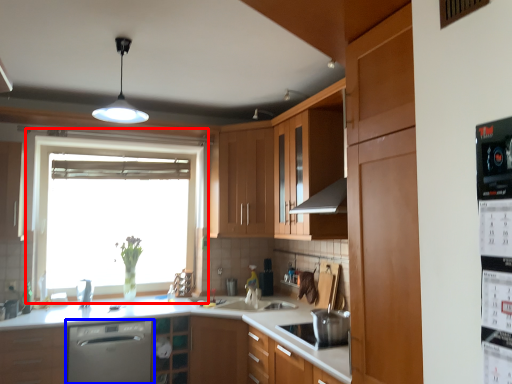
Question: Which point is further to the camera, window (highlighted by a red box) or home appliance (highlighted by a blue box)?

Choices:
 (A) window
 (B) home appliance

Answer: (A)